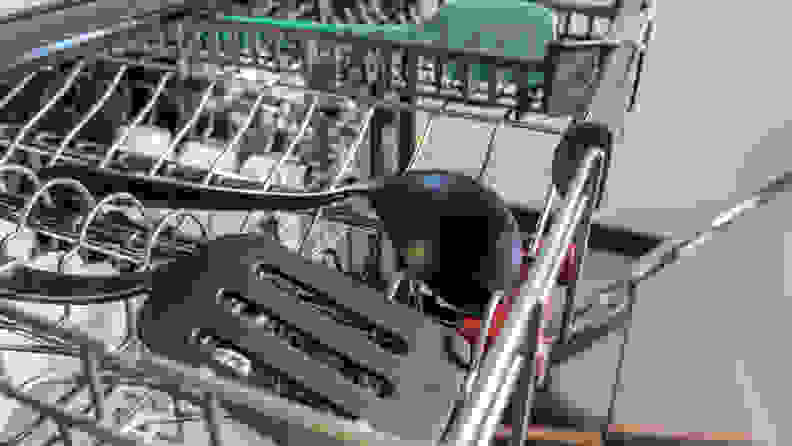
Where is `the top rack of dishwasher`? The width and height of the screenshot is (792, 446). the top rack of dishwasher is located at coordinates 565,205.